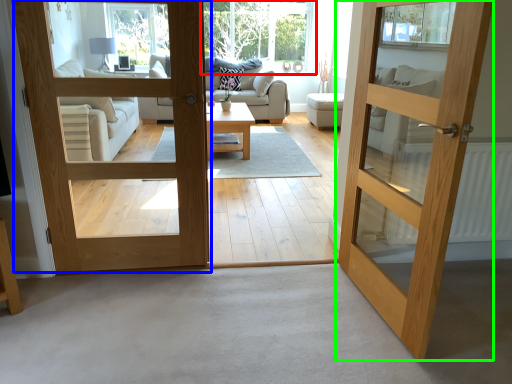
Question: Estimate the real-world distances between objects in this image. Which object is closer to window (highlighted by a red box), door (highlighted by a blue box) or door (highlighted by a green box)?

Choices:
 (A) door
 (B) door

Answer: (A)